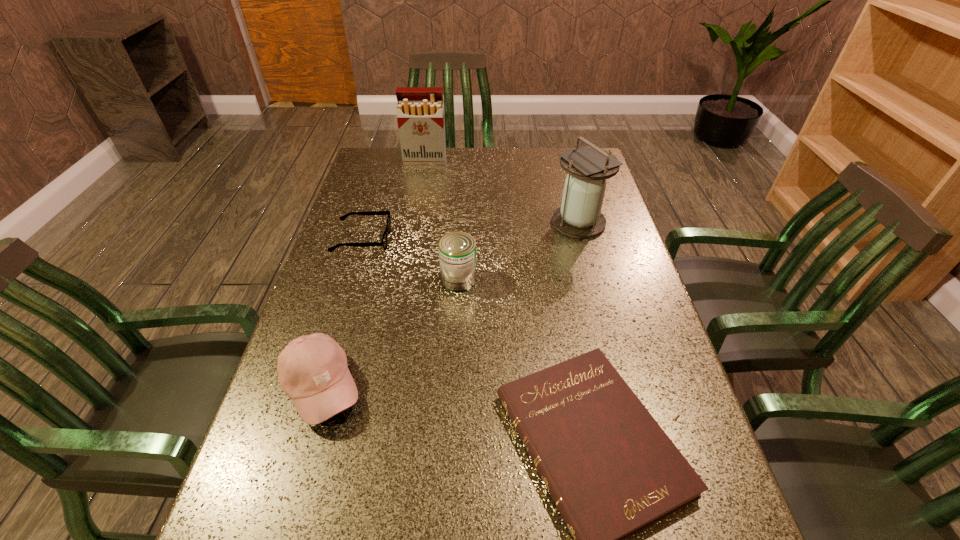
Identify which object is located as the third nearest to the third nearest object. Please provide its 2D coordinates. Your answer should be formatted as a tuple, i.e. [(x, y)], where the tuple contains the x and y coordinates of a point satisfying the conditions above.

[(312, 370)]

Where is `the second closest object relative to the baseball cap`? the second closest object relative to the baseball cap is located at coordinates (611, 470).

Identify the location of free space in the image that satisfies the following two spatial constraints: 1. on the front side of the third nearest object; 2. on the front-facing side of the baseball cap. (453, 387).